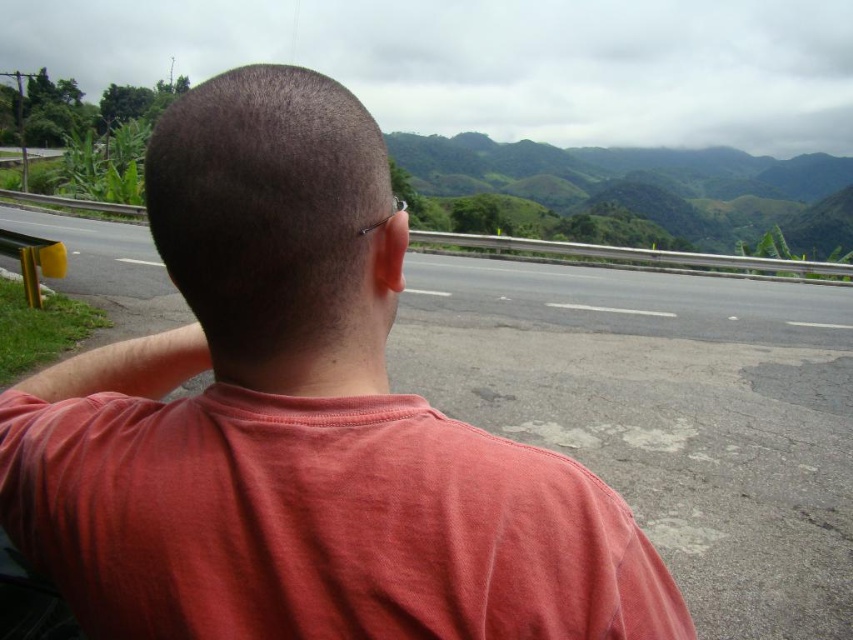
Based on the image, where is the green grassy hill at upper center located in terms of its 2D coordinates?

The green grassy hill at upper center is located at the 2D coordinate point of (x=633, y=195).

You are a hiker planning to walk from the asphalt road at center to the green grassy hill at upper center. Based on their widths, which path would you choose if you want to take the wider path?

The green grassy hill at upper center has a greater width than the asphalt road at center, so you should choose the path to the green grassy hill at upper center since it is wider.